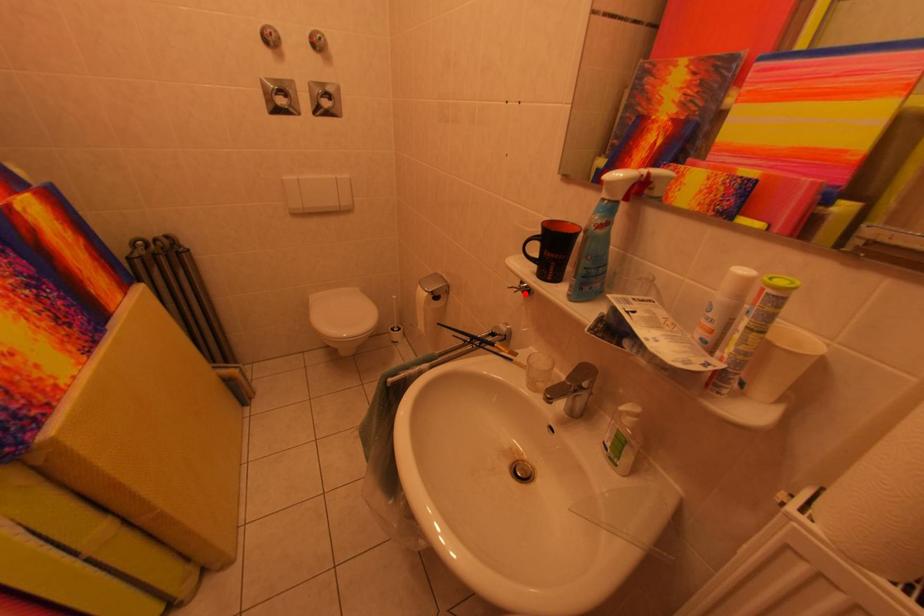
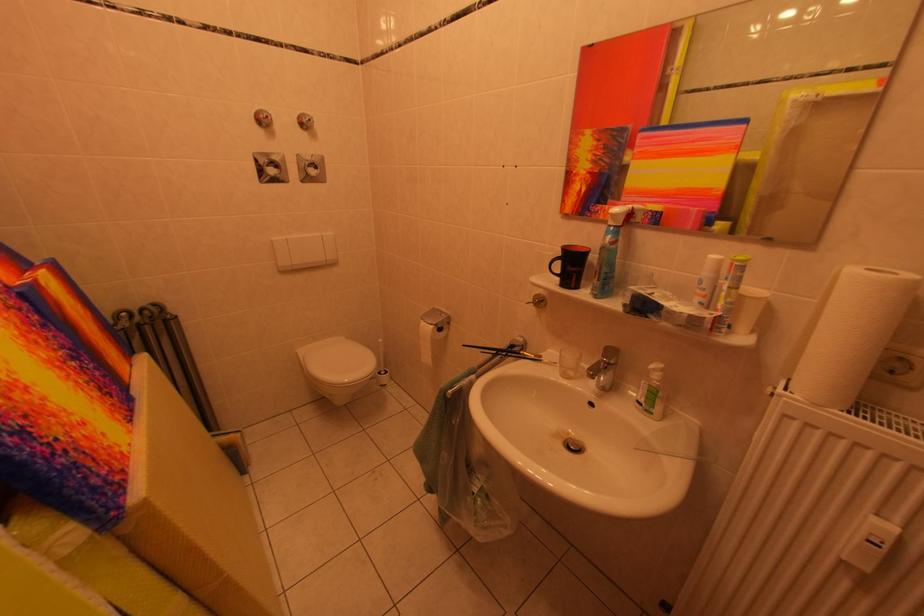
Question: I am providing you with two images of the same scene from different viewpoints. A red point is marked on the first image. Can you still see the location of the red point in image 2?

Choices:
 (A) Yes
 (B) No

Answer: (A)